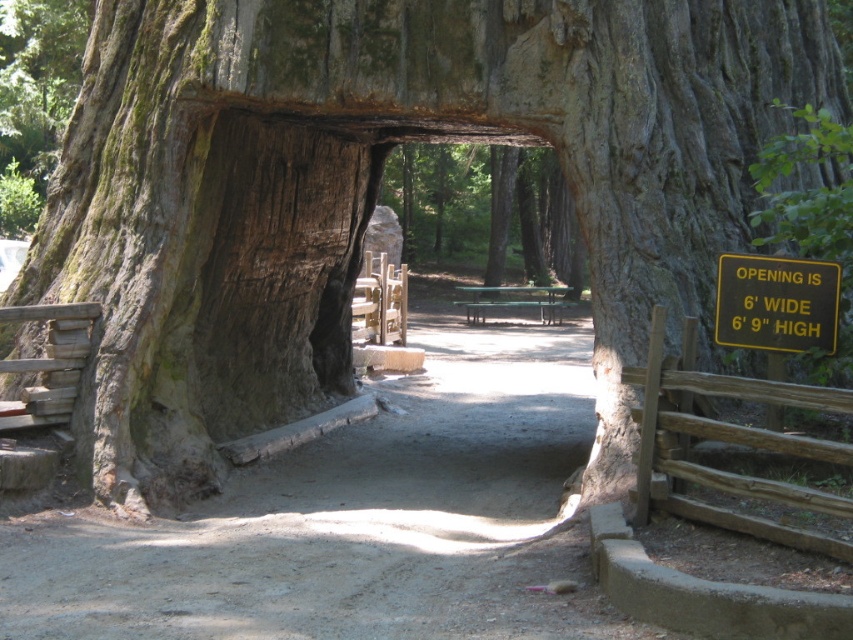
In the scene shown: Which is below, yellowmaterial/texturesign at upper right or green wooden bench at center?

Positioned lower is yellowmaterial/texturesign at upper right.

Is point (766, 257) closer to camera compared to point (540, 289)?

Yes.

Locate an element on the screen. The height and width of the screenshot is (640, 853). yellowmaterial/texturesign at upper right is located at coordinates (776, 304).

Which is behind, point (184, 602) or point (782, 282)?

The point (782, 282) is more distant.

Can you confirm if dirt path at center is positioned to the right of yellowmaterial/texturesign at upper right?

Incorrect, dirt path at center is not on the right side of yellowmaterial/texturesign at upper right.

Describe the element at coordinates (351, 522) in the screenshot. The image size is (853, 640). I see `dirt path at center` at that location.

This screenshot has height=640, width=853. Find the location of `dirt path at center`. dirt path at center is located at coordinates (351, 522).

Is point (293, 577) in front of point (547, 291)?

Yes, it is.

Is point (297, 484) positioned after point (543, 316)?

That is False.

Locate an element on the screen. dirt path at center is located at coordinates (351, 522).